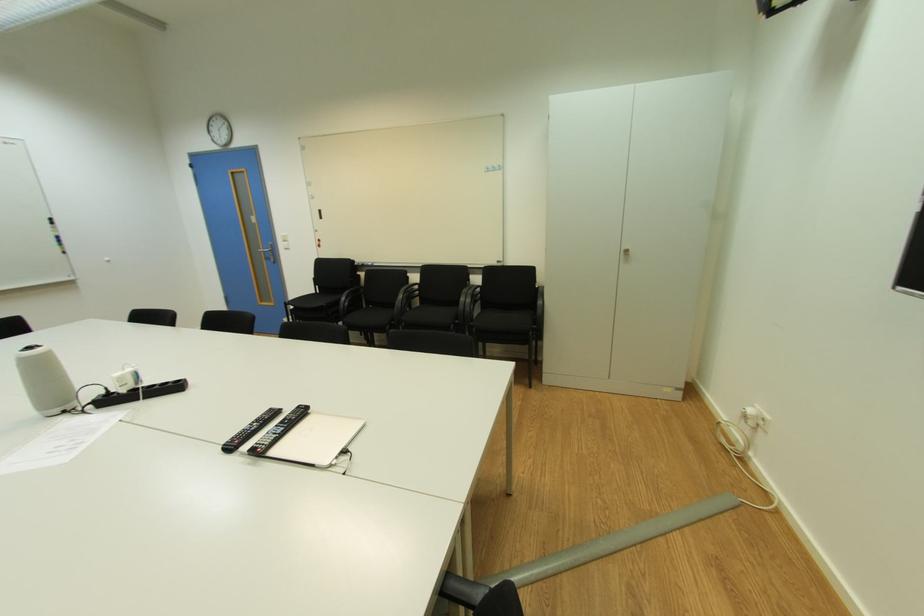
The location [44,379] corresponds to which object?

It corresponds to the white conference speaker in the image.